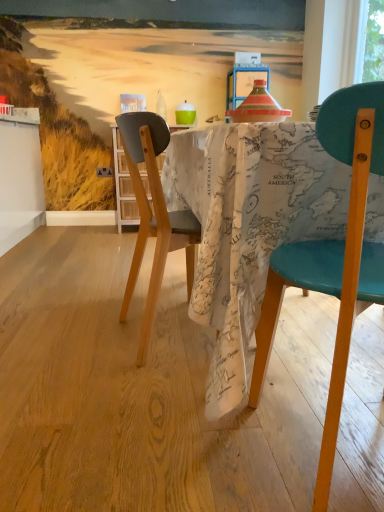
Question: Is map-patterned fabric at center to the left or to the right of wooden floor at center in the image?

Choices:
 (A) left
 (B) right

Answer: (B)

Question: From the image's perspective, is map-patterned fabric at center positioned above or below wooden floor at center?

Choices:
 (A) above
 (B) below

Answer: (A)

Question: Estimate the real-world distances between objects in this image. Which object is closer to the map-patterned fabric at center?

Choices:
 (A) translucent glass bottle at center
 (B) teal leather chair at right
 (C) wooden floor at center
 (D) map-patterned fabric at center

Answer: (B)

Question: Which of these objects is positioned closest to the translucent glass bottle at center?

Choices:
 (A) map-patterned fabric at center
 (B) wooden floor at center
 (C) map-patterned fabric at center
 (D) teal leather chair at right

Answer: (C)